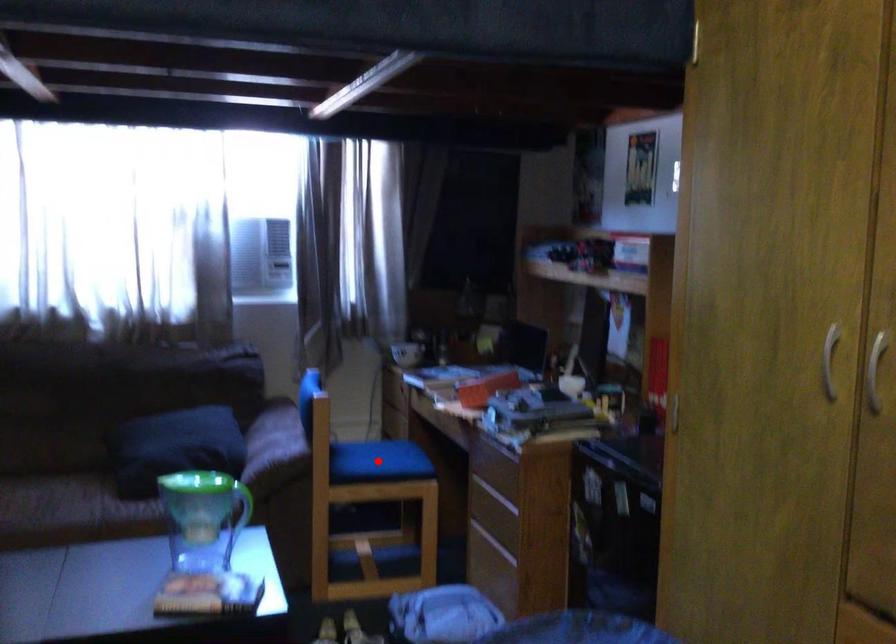
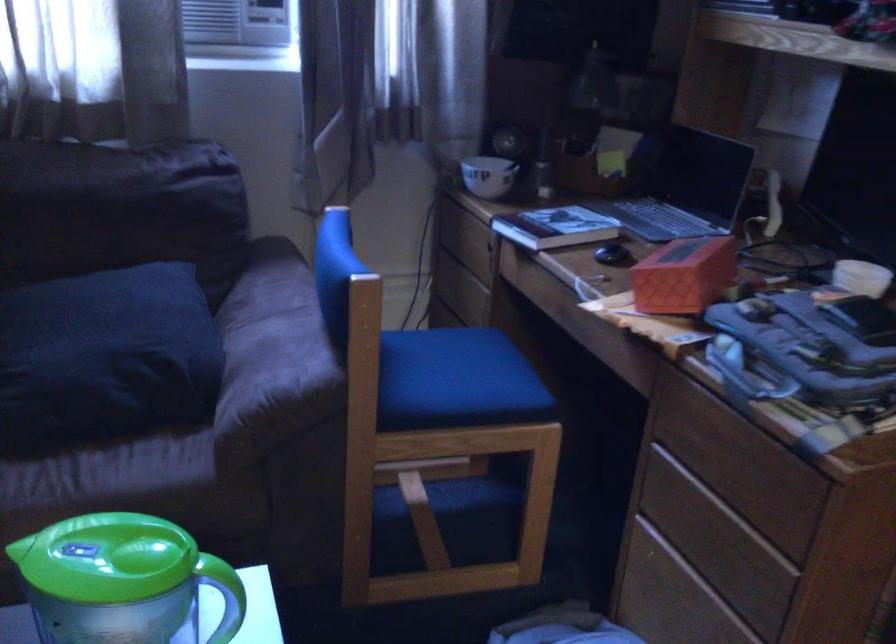
Find the pixel in the second image that matches the highlighted location in the first image.

(455, 381)